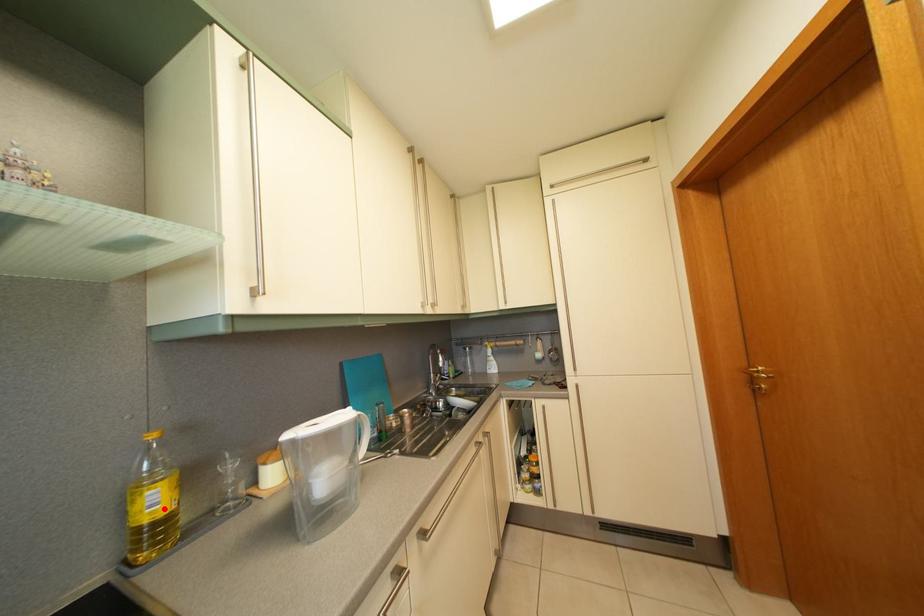
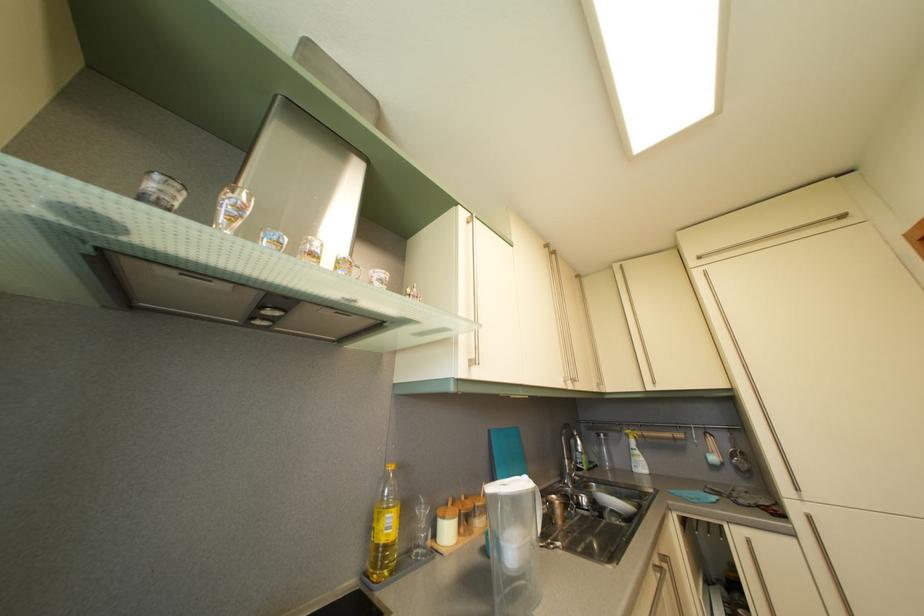
Where in the second image is the point corresponding to the highlighted location from the first image?

(396, 533)